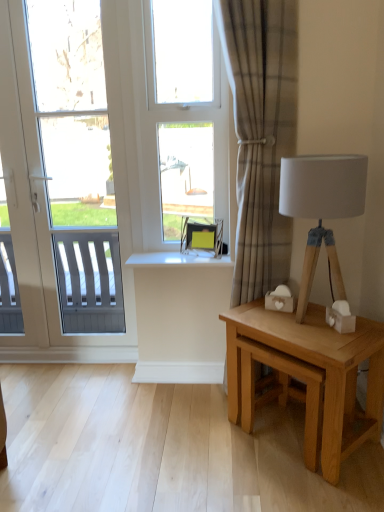
Question: From the image's perspective, would you say light brown wooden table at right is shown under clear glass window at center?

Choices:
 (A) no
 (B) yes

Answer: (B)

Question: Can you confirm if light brown wooden table at right is smaller than clear glass window at center?

Choices:
 (A) yes
 (B) no

Answer: (B)

Question: Is light brown wooden table at right positioned with its back to clear glass window at center?

Choices:
 (A) yes
 (B) no

Answer: (B)

Question: From the image's perspective, is light brown wooden table at right located above clear glass window at center?

Choices:
 (A) yes
 (B) no

Answer: (B)

Question: Can you confirm if light brown wooden table at right is shorter than clear glass window at center?

Choices:
 (A) yes
 (B) no

Answer: (A)

Question: Is point (170, 122) positioned closer to the camera than point (152, 257)?

Choices:
 (A) farther
 (B) closer

Answer: (B)

Question: From the image's perspective, is clear glass window at center above or below white glossy window sill at center?

Choices:
 (A) above
 (B) below

Answer: (A)

Question: Choose the correct answer: Is clear glass window at center inside white glossy window sill at center or outside it?

Choices:
 (A) outside
 (B) inside

Answer: (A)

Question: Considering the positions of clear glass window at center and white glossy window sill at center in the image, is clear glass window at center taller or shorter than white glossy window sill at center?

Choices:
 (A) short
 (B) tall

Answer: (B)

Question: Based on their positions, is white glossy window sill at center located to the left or right of matte black swivel chair at center?

Choices:
 (A) right
 (B) left

Answer: (B)

Question: Considering the positions of white glossy window sill at center and matte black swivel chair at center in the image, is white glossy window sill at center wider or thinner than matte black swivel chair at center?

Choices:
 (A) wide
 (B) thin

Answer: (A)

Question: In terms of height, does white glossy window sill at center look taller or shorter compared to matte black swivel chair at center?

Choices:
 (A) tall
 (B) short

Answer: (B)

Question: Is point (167, 258) closer or farther from the camera than point (218, 246)?

Choices:
 (A) farther
 (B) closer

Answer: (B)

Question: Do you think white plastic window at left is within white glossy window sill at center, or outside of it?

Choices:
 (A) outside
 (B) inside

Answer: (A)

Question: Considering the positions of white plastic window at left and white glossy window sill at center in the image, is white plastic window at left taller or shorter than white glossy window sill at center?

Choices:
 (A) tall
 (B) short

Answer: (A)